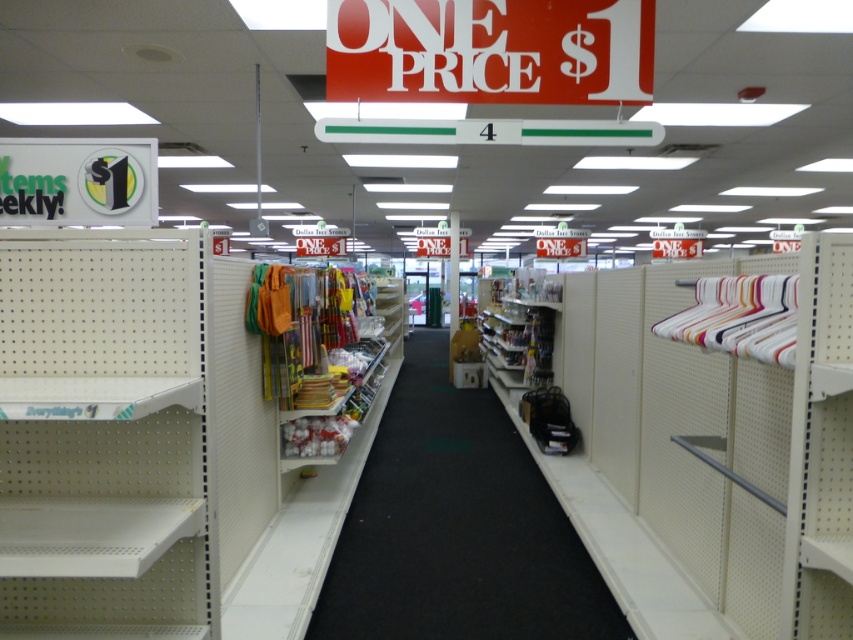
You are a store employee who needs to place a tall display stand that requires a minimum height of 1.5 meters. Looking at the white matte shelf at right and the white plastic shelves at center, which shelf would be suitable for the display stand?

The white matte shelf at right is taller than the white plastic shelves at center, so the white matte shelf at right would be suitable for the display stand since it meets the minimum height requirement.

You are organizing the store and need to place a large display that requires more shelf space. Which shelf should you choose between the white matte shelf at left and the white plastic shelves at center?

You should choose the white plastic shelves at center because they occupy more space than the white matte shelf at left, making them suitable for the large display requiring more shelf space.